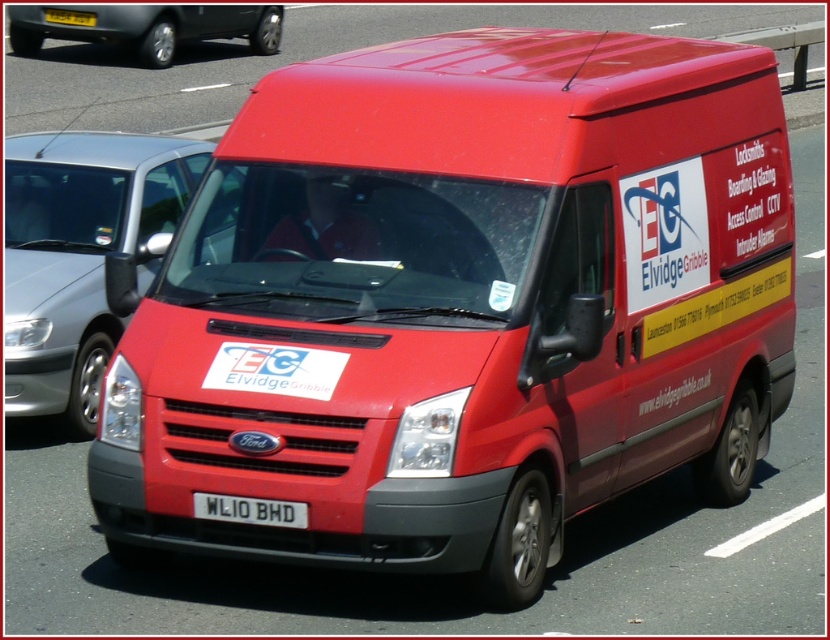
Question: Which is farther from the matte red van at center?

Choices:
 (A) yellow plastic license plate at center
 (B) metallic gray car at upper left

Answer: (A)

Question: Can you confirm if metallic gray car at upper left is wider than yellow plastic license plate at center?

Choices:
 (A) no
 (B) yes

Answer: (B)

Question: Which point is closer to the camera?

Choices:
 (A) (77, 291)
 (B) (203, 493)
 (C) (15, 44)
 (D) (91, 20)

Answer: (B)

Question: Among these points, which one is nearest to the camera?

Choices:
 (A) (203, 513)
 (B) (84, 19)
 (C) (183, 179)
 (D) (154, 36)

Answer: (A)

Question: Is matte red van at center to the right of yellow plastic license plate at center from the viewer's perspective?

Choices:
 (A) yes
 (B) no

Answer: (A)

Question: Does metallic gray car at upper left appear over white plastic license plate at center?

Choices:
 (A) no
 (B) yes

Answer: (B)